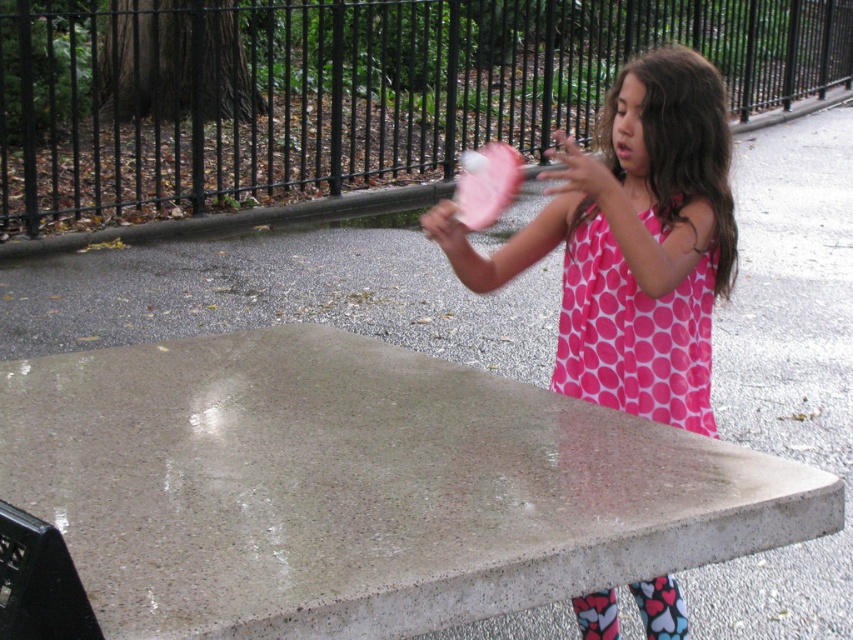
Question: Which point appears farthest from the camera in this image?

Choices:
 (A) (675, 209)
 (B) (351, 534)
 (C) (573, 328)

Answer: (C)

Question: Is concrete picnic table at center thinner than pink dotted dress at center?

Choices:
 (A) no
 (B) yes

Answer: (A)

Question: Which point is closer to the camera?

Choices:
 (A) (537, 426)
 (B) (614, 323)

Answer: (A)

Question: Is concrete picnic table at center to the left of pink dotted fabric dress at upper right from the viewer's perspective?

Choices:
 (A) yes
 (B) no

Answer: (A)

Question: Which object is farther from the camera taking this photo?

Choices:
 (A) pink dotted fabric dress at upper right
 (B) pink dotted dress at center

Answer: (A)

Question: Is pink dotted dress at center bigger than pink dotted fabric dress at upper right?

Choices:
 (A) yes
 (B) no

Answer: (A)